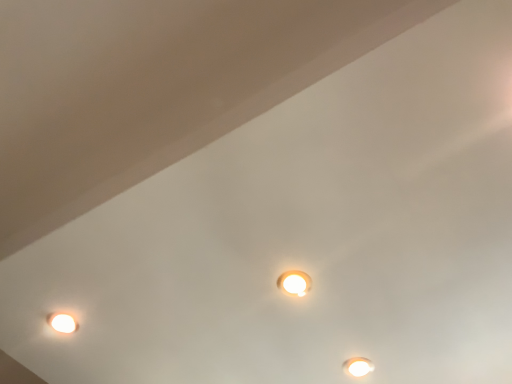
Question: Which direction should I rotate to look at white glossy lamp at center, which appears as the second lamp when viewed from the back, — up or down?

Choices:
 (A) down
 (B) up

Answer: (A)

Question: From a real-world perspective, is white glossy lamp at lower right, which appears as the second lamp when viewed from the left, beneath white glossy lamp at center, the second lamp from the right?

Choices:
 (A) no
 (B) yes

Answer: (A)

Question: From the image's perspective, is white glossy lamp at lower right, the 1th lamp positioned from the back, located beneath white glossy lamp at center, which ranks as the 1th lamp in front-to-back order?

Choices:
 (A) no
 (B) yes

Answer: (B)

Question: Is white glossy lamp at lower right, the 1th lamp from the bottom, oriented away from white glossy lamp at center, the second lamp from the bottom?

Choices:
 (A) yes
 (B) no

Answer: (B)

Question: Considering the relative positions of white glossy lamp at lower right, which ranks as the 2th lamp in front-to-back order, and white glossy lamp at center, which appears as the second lamp when viewed from the back, in the image provided, is white glossy lamp at lower right, which ranks as the 2th lamp in front-to-back order, to the right of white glossy lamp at center, which appears as the second lamp when viewed from the back, from the viewer's perspective?

Choices:
 (A) yes
 (B) no

Answer: (A)

Question: Could you tell me if white glossy lamp at lower right, the 1th lamp positioned from the back, is facing white glossy lamp at center, which ranks as the 1th lamp in front-to-back order?

Choices:
 (A) no
 (B) yes

Answer: (B)

Question: Is white glossy lamp at lower right, acting as the second lamp starting from the top, taller than white glossy lamp at center, the second lamp from the bottom?

Choices:
 (A) yes
 (B) no

Answer: (A)

Question: Is white glossy lamp at center, which appears as the second lamp when viewed from the back, facing away from white glossy lamp at lower right, marked as the 1th lamp in a right-to-left arrangement?

Choices:
 (A) no
 (B) yes

Answer: (A)

Question: Is white glossy lamp at center, which appears as the 1th lamp when viewed from the left, positioned in front of white glossy lamp at lower right, which appears as the second lamp when viewed from the left?

Choices:
 (A) yes
 (B) no

Answer: (A)

Question: Can you confirm if white glossy lamp at center, the second lamp from the bottom, is taller than white glossy lamp at lower right, acting as the second lamp starting from the top?

Choices:
 (A) yes
 (B) no

Answer: (B)

Question: Is white glossy lamp at center, which appears as the 1th lamp when viewed from the left, completely or partially outside of white glossy lamp at lower right, which ranks as the 2th lamp in front-to-back order?

Choices:
 (A) yes
 (B) no

Answer: (A)

Question: Is white glossy lamp at center, which is the 1th lamp from top to bottom, directly adjacent to white glossy lamp at lower right, which ranks as the 2th lamp in front-to-back order?

Choices:
 (A) yes
 (B) no

Answer: (B)

Question: From the image's perspective, is white glossy lamp at center, which appears as the 1th lamp when viewed from the left, located beneath white glossy lamp at lower right, the 1th lamp positioned from the back?

Choices:
 (A) yes
 (B) no

Answer: (B)

Question: From the image's perspective, is white glossy lamp at lower right, marked as the 1th lamp in a right-to-left arrangement, above or below white glossy lamp at center, which is the 1th lamp from top to bottom?

Choices:
 (A) above
 (B) below

Answer: (B)